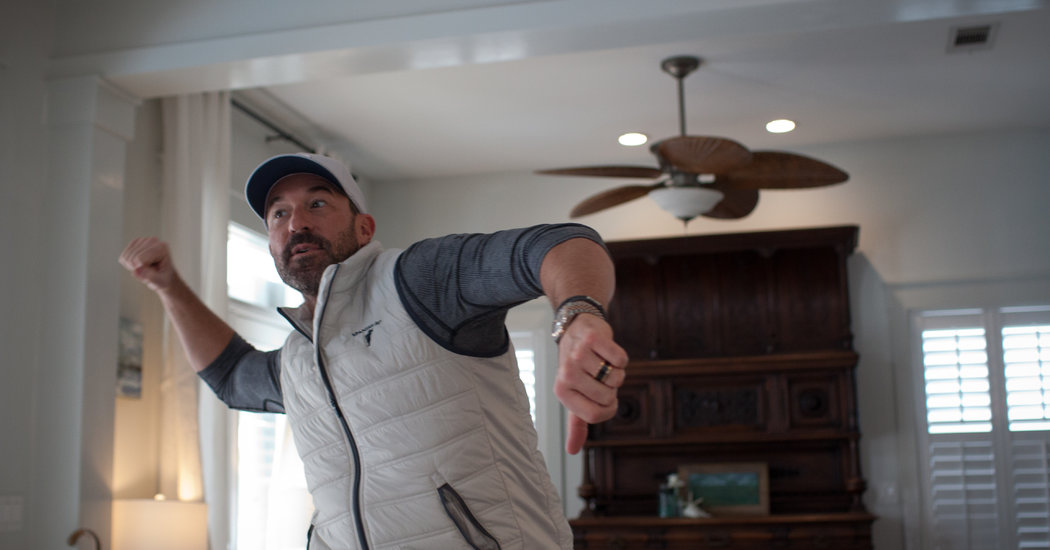
I want to click on white ceiling, so click(x=483, y=123).